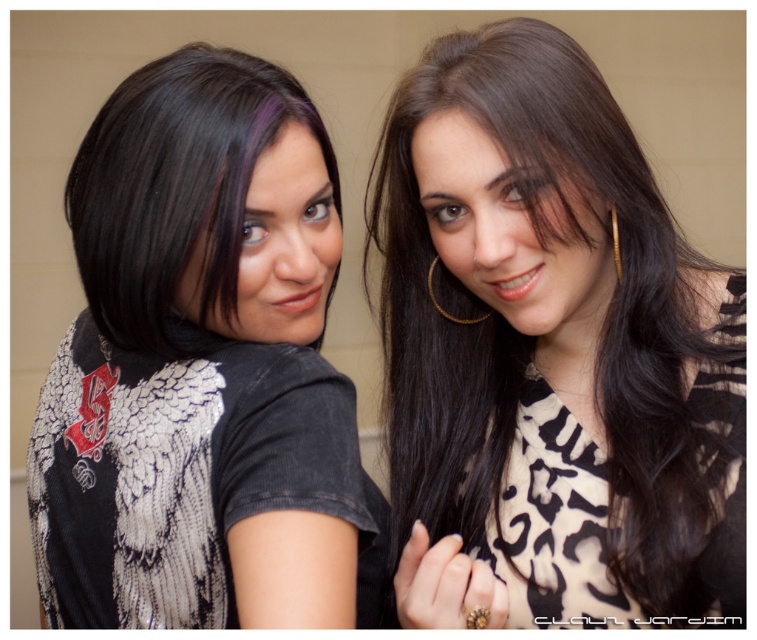
Question: Among these points, which one is farthest from the camera?

Choices:
 (A) (125, 330)
 (B) (743, 358)
 (C) (201, 406)
 (D) (614, 220)

Answer: (B)

Question: Which object is the closest to the matte black shirt at left?

Choices:
 (A) black silky hair at left
 (B) gold metallic hoop earring at upper center
 (C) black printed shirt at upper right

Answer: (A)

Question: Does matte black shirt at left have a larger size compared to gold metallic hoop earring at upper center?

Choices:
 (A) yes
 (B) no

Answer: (A)

Question: Can you confirm if black printed shirt at upper right is positioned below black silky hair at left?

Choices:
 (A) no
 (B) yes

Answer: (B)

Question: Can you confirm if matte black shirt at left is positioned below black silky hair at left?

Choices:
 (A) yes
 (B) no

Answer: (A)

Question: Which point is farther to the camera?

Choices:
 (A) (167, 86)
 (B) (394, 522)

Answer: (B)